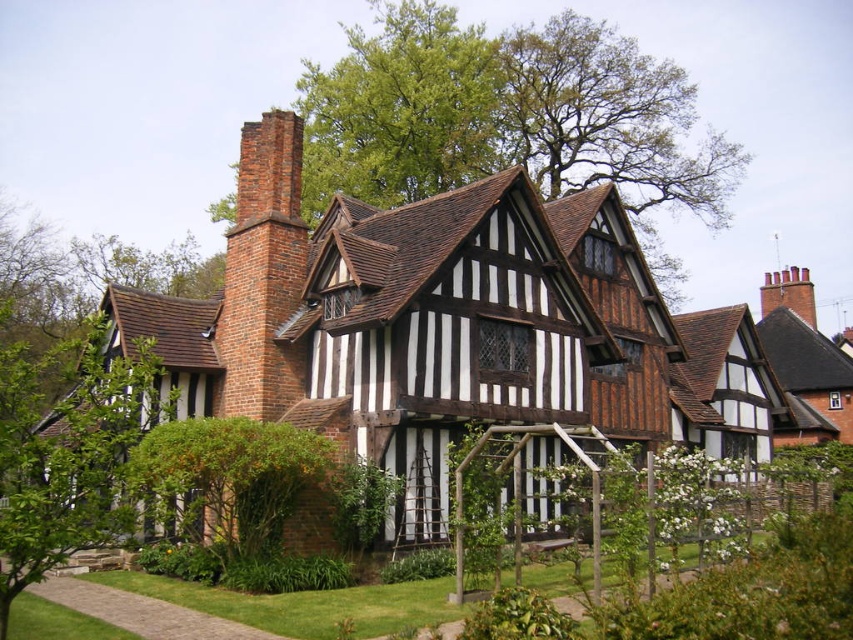
Does brick chimney at upper left appear under brick chimney at upper right?

Correct, brick chimney at upper left is located below brick chimney at upper right.

Who is higher up, brick chimney at upper left or brick chimney at upper right?

brick chimney at upper right

Measure the distance between brick chimney at upper left and camera.

brick chimney at upper left and camera are 45.65 meters apart from each other.

Identify the location of brick chimney at upper left. This screenshot has height=640, width=853. (263, 273).

Measure the distance between point (62,419) and camera.

Point (62,419) is 50.57 meters away from camera.

Is green leafy bush at left positioned in front of green leafy bush at lower left?

Yes, green leafy bush at left is closer to the viewer.

Identify the location of green leafy bush at left. This screenshot has height=640, width=853. (68, 454).

Describe the element at coordinates (229, 480) in the screenshot. I see `green leafy bush at lower left` at that location.

Who is lower down, green leafy bush at lower left or brick chimney at upper right?

Positioned lower is green leafy bush at lower left.

Image resolution: width=853 pixels, height=640 pixels. What are the coordinates of `green leafy bush at lower left` in the screenshot? It's located at (229, 480).

The image size is (853, 640). In order to click on green leafy bush at lower left in this screenshot , I will do `click(229, 480)`.